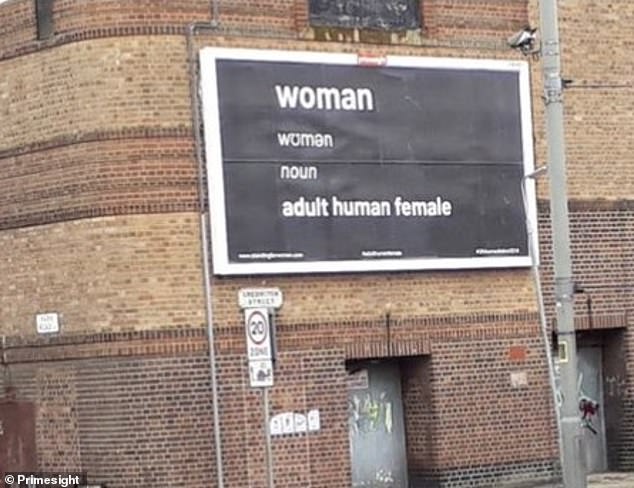
In order to click on cctv camera in this screenshot , I will do click(x=525, y=42).